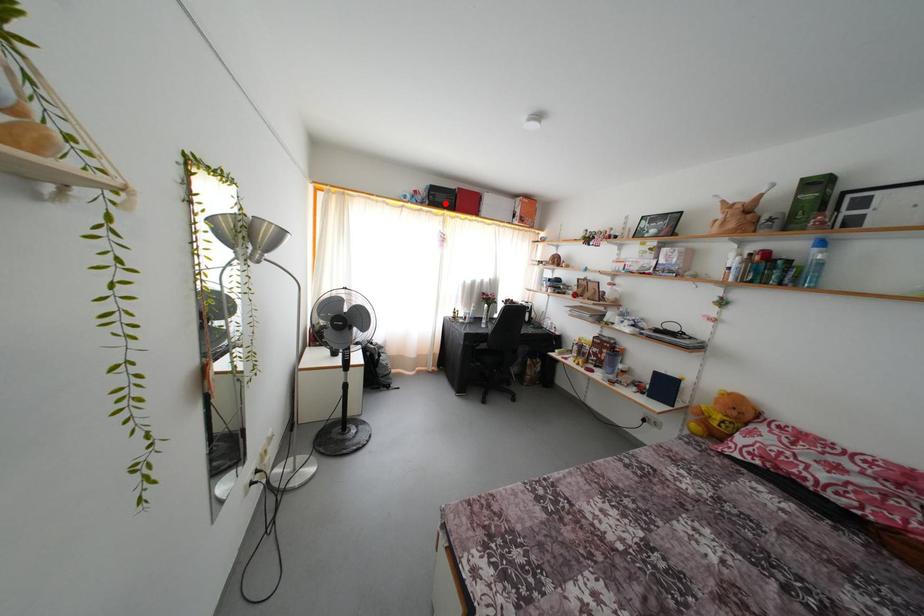
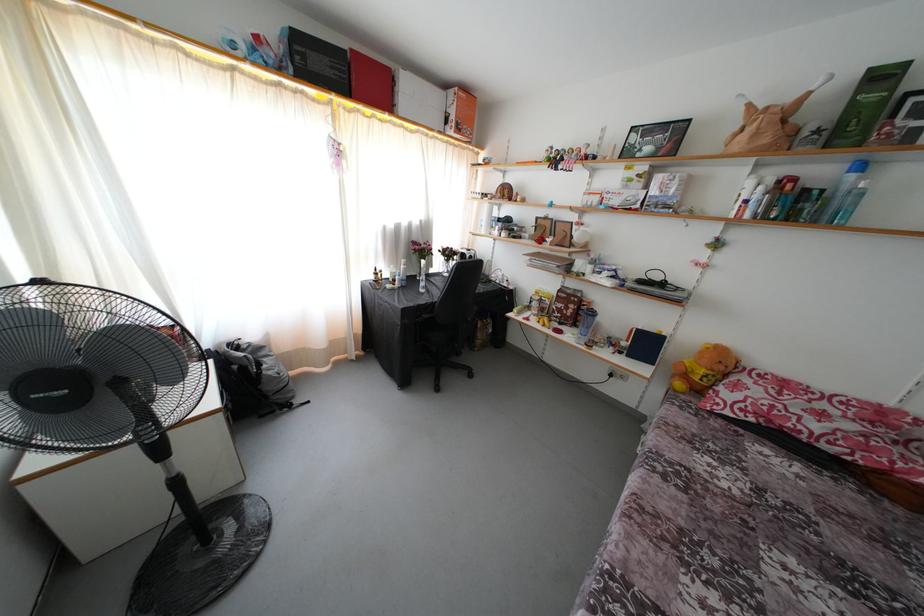
Find the pixel in the second image that matches the highlighted location in the first image.

(322, 69)